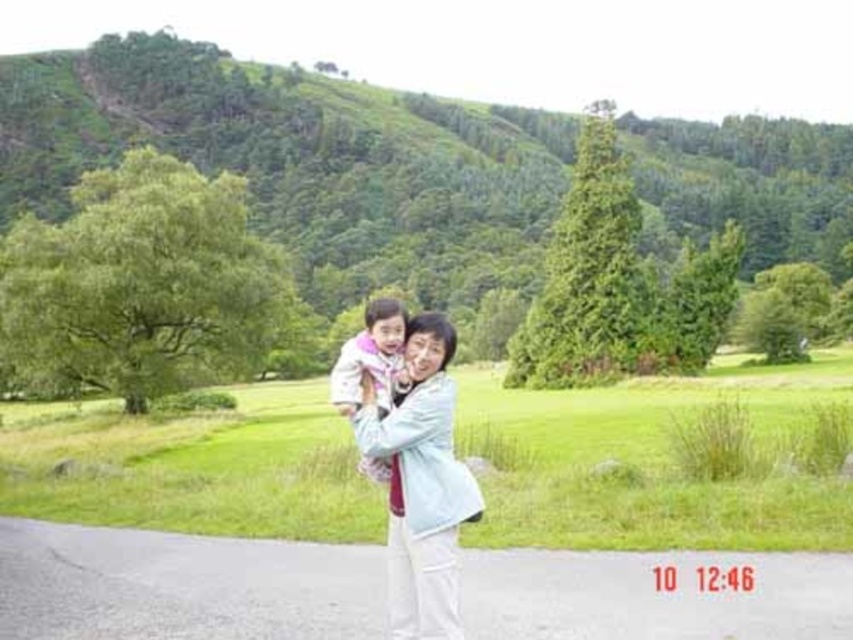
You are standing at the point marked as point [408,442] in the image. You want to walk to the nearest tree. Which direction should you walk to reach the nearest tree?

The nearest tree is located to the left side of the image, so you should walk towards the left to reach the nearest tree.

You are a photographer trying to capture a photo of the green grass at center and the light blue fabric at center. If you want to ensure both are fully visible in your shot, which object should you focus on to frame the wider one?

The green grass at center is wider than the light blue fabric at center, so you should focus on framing the green grass at center to ensure it is fully visible, which will naturally include the light blue fabric at center in the shot.